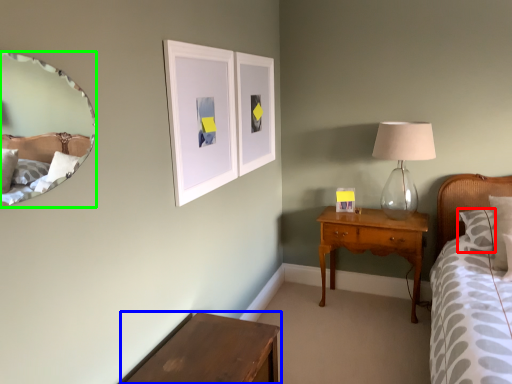
Question: Which is farther away from pillow (highlighted by a red box)? table (highlighted by a blue box) or mirror (highlighted by a green box)?

Choices:
 (A) table
 (B) mirror

Answer: (B)